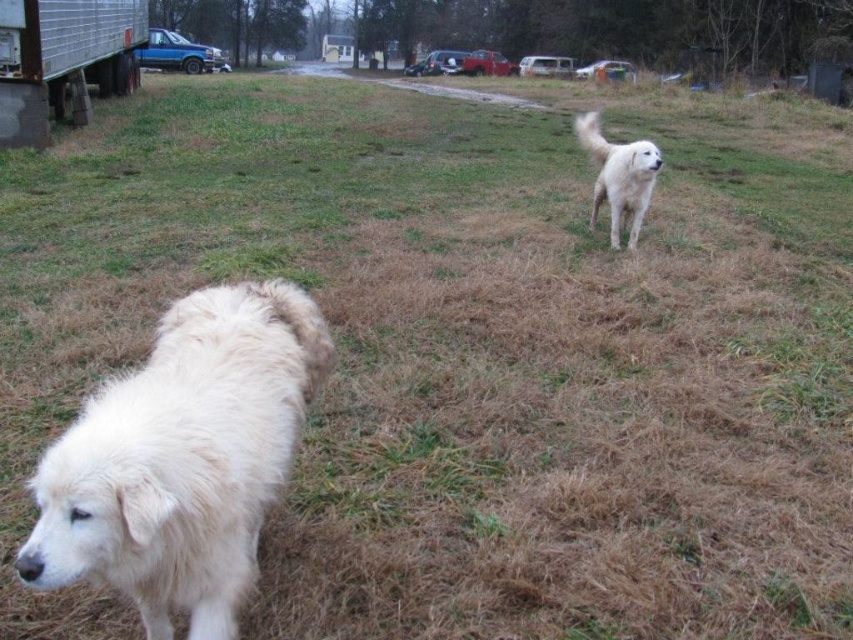
Measure the distance between white fluffy dog at lower left and camera.

A distance of 4.47 feet exists between white fluffy dog at lower left and camera.

Can you confirm if white fluffy dog at lower left is smaller than white fluffy dog at upper right?

Yes.

Does point (247, 326) come farther from viewer compared to point (625, 154)?

No, it is not.

Where is `white fluffy dog at lower left`? Image resolution: width=853 pixels, height=640 pixels. white fluffy dog at lower left is located at coordinates (183, 458).